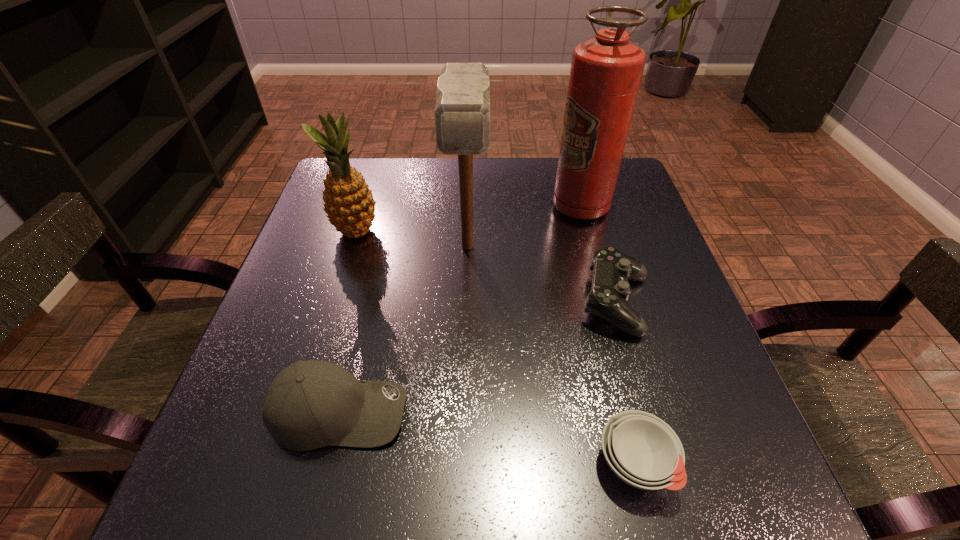
In order to click on control present at the right edge in this screenshot , I will do `click(610, 292)`.

You are a GUI agent. You are given a task and a screenshot of the screen. Output one action in this format:
    pyautogui.click(x=<x>, y=<y>)
    Task: Click on the soup bowl at the right edge
    The image size is (960, 540).
    Given the screenshot: What is the action you would take?
    pyautogui.click(x=642, y=450)

Where is `object that is positioned at the far right corner`? object that is positioned at the far right corner is located at coordinates (606, 72).

Where is `object positioned at the near right corner`? The image size is (960, 540). object positioned at the near right corner is located at coordinates (642, 450).

The image size is (960, 540). In the image, there is a desktop. What are the coordinates of `vacant space at the far edge` in the screenshot? It's located at (420, 171).

This screenshot has height=540, width=960. In order to click on vacant space at the near edge in this screenshot , I will do `click(617, 518)`.

Locate an element on the screen. Image resolution: width=960 pixels, height=540 pixels. blank space at the left edge is located at coordinates (327, 251).

In the image, there is a desktop. Where is `vacant space at the right edge`? vacant space at the right edge is located at coordinates (747, 448).

In the image, there is a desktop. Where is `free space at the far left corner`? The image size is (960, 540). free space at the far left corner is located at coordinates (376, 168).

The height and width of the screenshot is (540, 960). In the image, there is a desktop. Identify the location of vacant area at the near left corner. (209, 475).